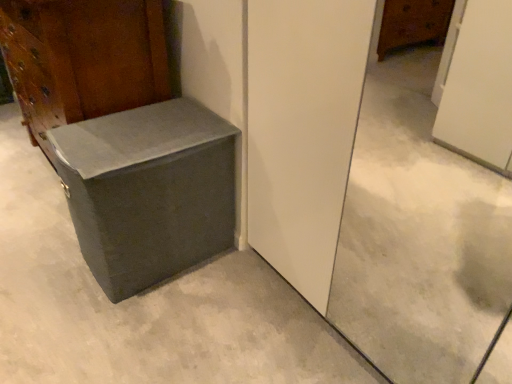
Question: Is matte gray cardboard box at lower left thinner than matte gray trunk at lower left?

Choices:
 (A) yes
 (B) no

Answer: (B)

Question: Are matte gray cardboard box at lower left and matte gray trunk at lower left making contact?

Choices:
 (A) yes
 (B) no

Answer: (B)

Question: From a real-world perspective, does matte gray cardboard box at lower left stand above matte gray trunk at lower left?

Choices:
 (A) yes
 (B) no

Answer: (B)

Question: Could you tell me if matte gray cardboard box at lower left is facing matte gray trunk at lower left?

Choices:
 (A) yes
 (B) no

Answer: (B)

Question: From a real-world perspective, is matte gray cardboard box at lower left below matte gray trunk at lower left?

Choices:
 (A) yes
 (B) no

Answer: (A)

Question: Relative to matte gray cardboard box at lower left, is matte gray trunk at lower left in front or behind?

Choices:
 (A) front
 (B) behind

Answer: (B)

Question: From their relative heights in the image, would you say matte gray trunk at lower left is taller or shorter than matte gray cardboard box at lower left?

Choices:
 (A) tall
 (B) short

Answer: (A)

Question: Looking at the image, does matte gray trunk at lower left seem bigger or smaller compared to matte gray cardboard box at lower left?

Choices:
 (A) small
 (B) big

Answer: (B)

Question: Considering the positions of point 61,21 and point 218,190, is point 61,21 closer or farther from the camera than point 218,190?

Choices:
 (A) closer
 (B) farther

Answer: (A)

Question: Is point (143, 334) positioned closer to the camera than point (25, 119)?

Choices:
 (A) farther
 (B) closer

Answer: (B)

Question: Is gray concrete at center taller or shorter than matte gray trunk at lower left?

Choices:
 (A) short
 (B) tall

Answer: (A)

Question: Would you say gray concrete at center is to the left or to the right of matte gray trunk at lower left in the picture?

Choices:
 (A) right
 (B) left

Answer: (B)

Question: From the image's perspective, relative to matte gray trunk at lower left, is gray concrete at center above or below?

Choices:
 (A) above
 (B) below

Answer: (B)

Question: Is gray concrete at center in front of or behind matte gray cardboard box at lower left in the image?

Choices:
 (A) front
 (B) behind

Answer: (A)

Question: Is point (286, 334) closer or farther from the camera than point (164, 155)?

Choices:
 (A) closer
 (B) farther

Answer: (B)